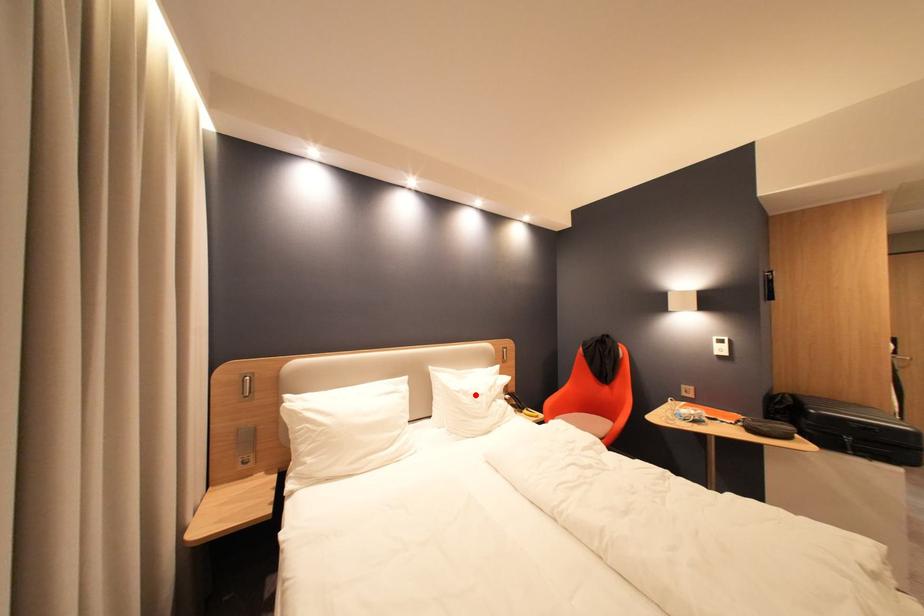
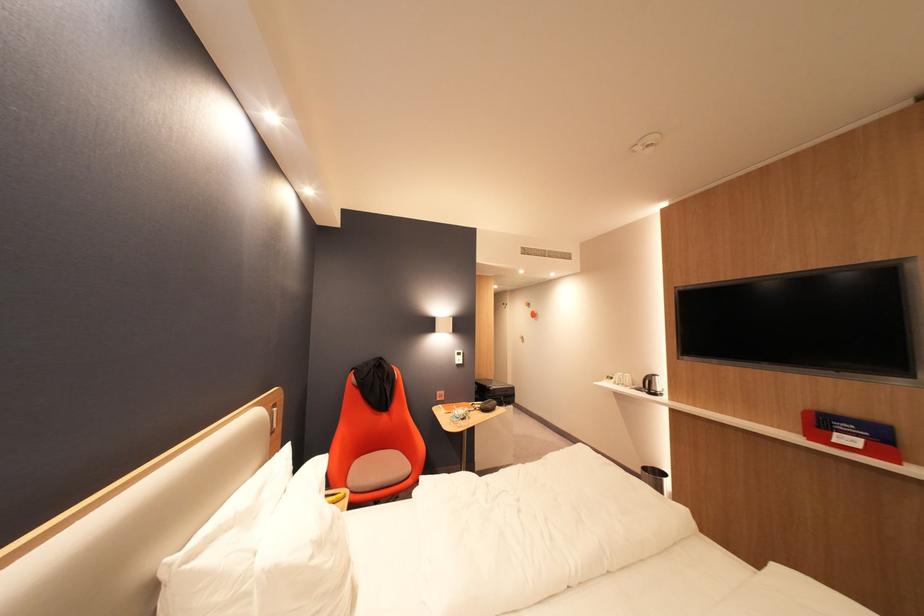
Locate, in the second image, the point that corresponds to the highlighted location in the first image.

(330, 545)